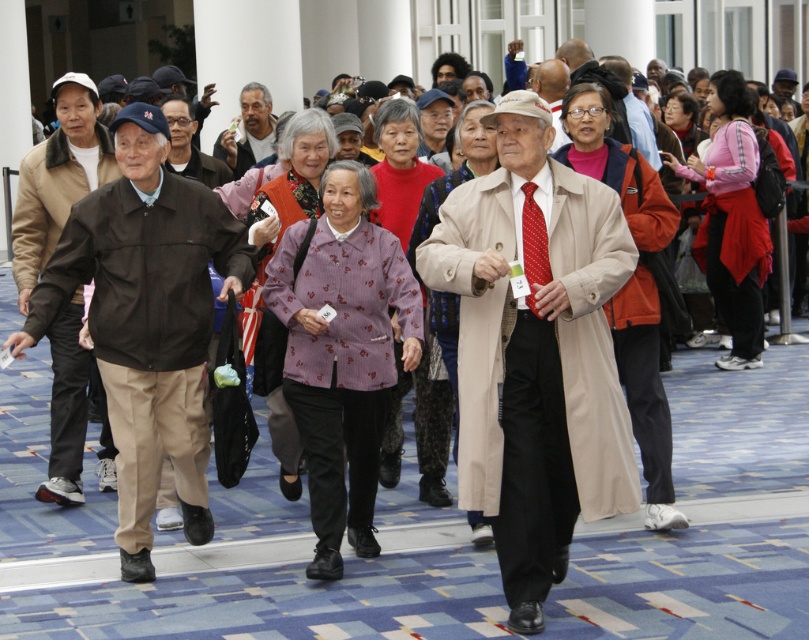
You are an event organizer and need to direct attendees to their seats. You notice two jackets in the foreground of the image. Which jacket is closer to the center of the image, the matte brown jacket at left or the matte black jacket at left?

The matte brown jacket at left is positioned on the right side of the matte black jacket at left, so the matte brown jacket at left is closer to the center of the image.

You are standing in the same room and see both the matte brown jacket at left and the matte black jacket at left. Which jacket is nearer to you?

The matte brown jacket at left is closer to the viewer than the matte black jacket at left, so the matte brown jacket at left is nearer to you.